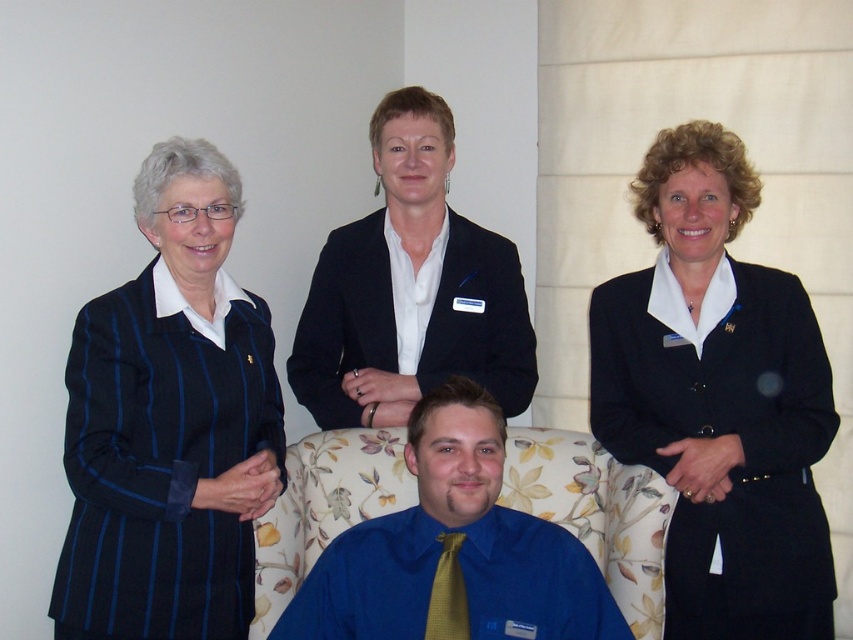
You are a photographer setting up a shoot in the scene described. You need to place a light source between the black matte blazer at right and the blue striped blazer at left. Which blazer should the light be closer to based on their positions?

The black matte blazer at right is closer to the viewer than the blue striped blazer at left, so the light should be placed closer to the black matte blazer at right to ensure both are well lit.

You are a tailor measuring blazers for alterations. You have two blazers to assess in the image. Which blazer has a greater width between the black matte blazer at right and the blue striped blazer at left?

The black matte blazer at right has a greater width than the blue striped blazer at left.